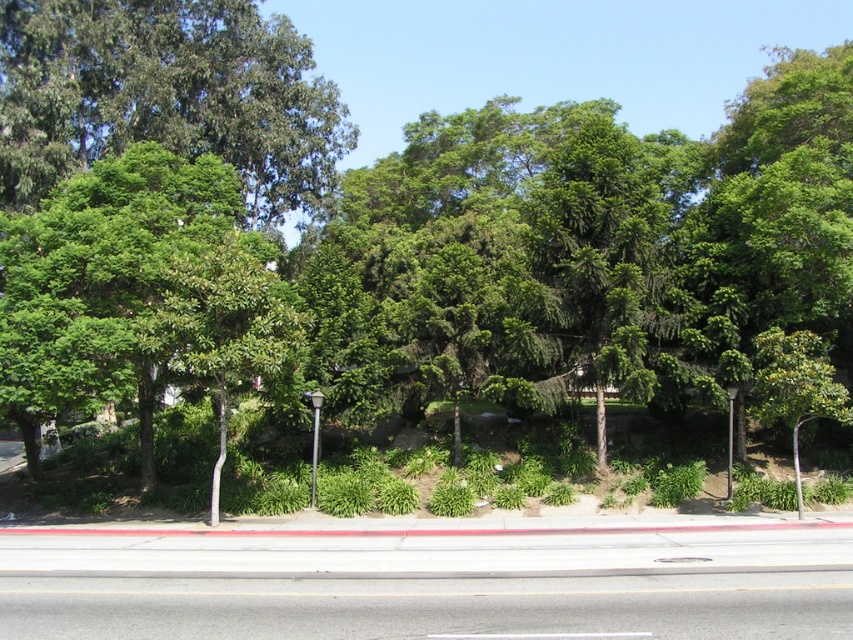
Question: In this image, where is green leafy tree at upper left located relative to black metal pole at center?

Choices:
 (A) above
 (B) below

Answer: (A)

Question: Among these objects, which one is nearest to the camera?

Choices:
 (A) green leafy tree at center
 (B) black metal pole at center

Answer: (A)

Question: Is green leafy tree at upper left behind black metal pole at center?

Choices:
 (A) yes
 (B) no

Answer: (A)

Question: From the image, what is the correct spatial relationship of green leafy tree at upper left in relation to black metal pole at center?

Choices:
 (A) right
 (B) left

Answer: (B)

Question: Among these objects, which one is farthest from the camera?

Choices:
 (A) black metal pole at center
 (B) green leafy tree at center

Answer: (A)

Question: Which object is the farthest from the green leafy tree at center?

Choices:
 (A) black metal pole at center
 (B) green leafy tree at upper left

Answer: (B)